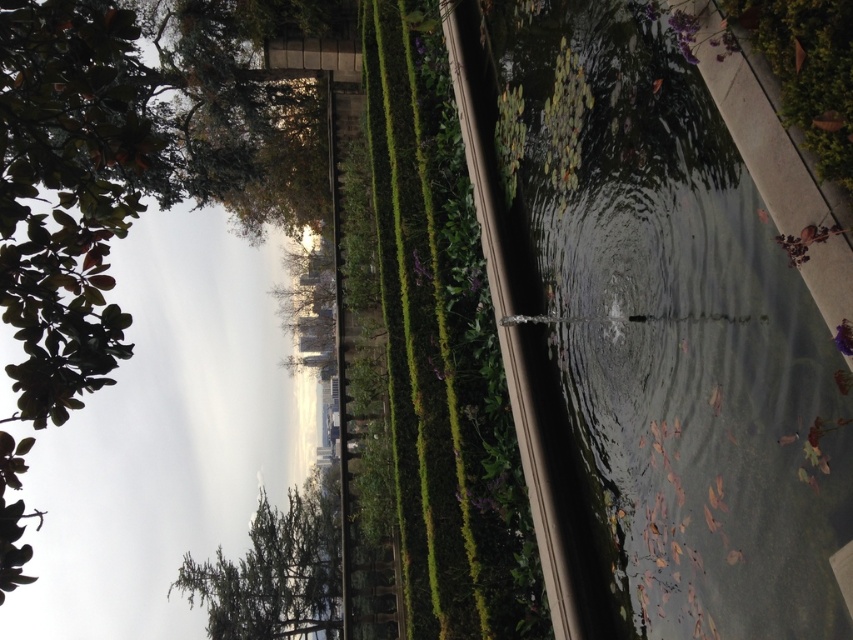
Does green leafy tree at upper left appear on the left side of green leafy tree at lower left?

Yes, green leafy tree at upper left is to the left of green leafy tree at lower left.

Which is behind, point (71, 140) or point (238, 614)?

The point (238, 614) is more distant.

Identify the location of green leafy tree at upper left. (68, 189).

Between clear glass pond at center and green leafy tree at lower left, which one has less height?

With less height is clear glass pond at center.

Can you confirm if clear glass pond at center is smaller than green leafy tree at lower left?

Indeed, clear glass pond at center has a smaller size compared to green leafy tree at lower left.

Between point (845, 522) and point (196, 582), which one is positioned behind?

The point (196, 582) is more distant.

Locate an element on the screen. clear glass pond at center is located at coordinates (677, 330).

Is clear glass pond at center thinner than green leafy tree at upper left?

Yes.

Does point (592, 33) lie in front of point (25, 324)?

No, it is behind (25, 324).

Where is `clear glass pond at center`? clear glass pond at center is located at coordinates (677, 330).